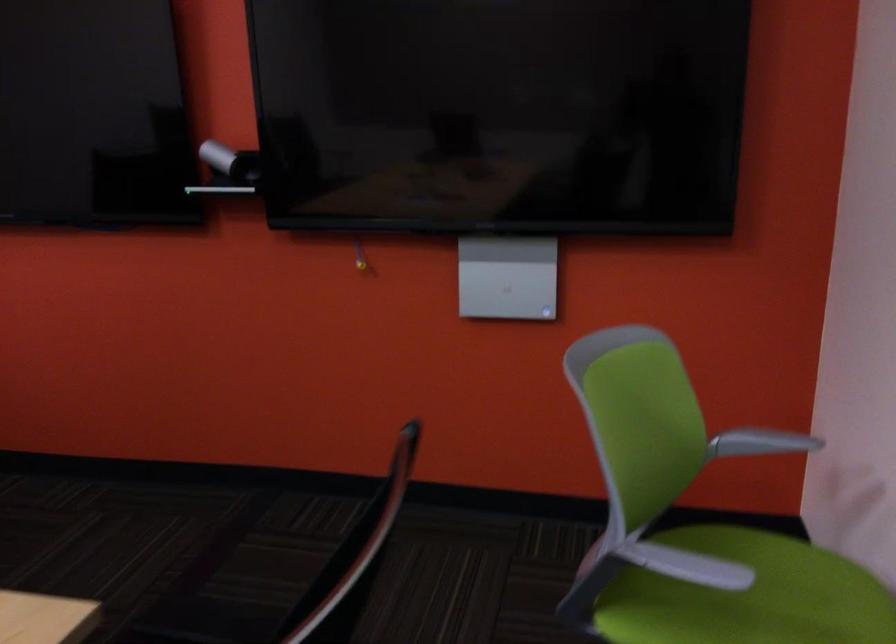
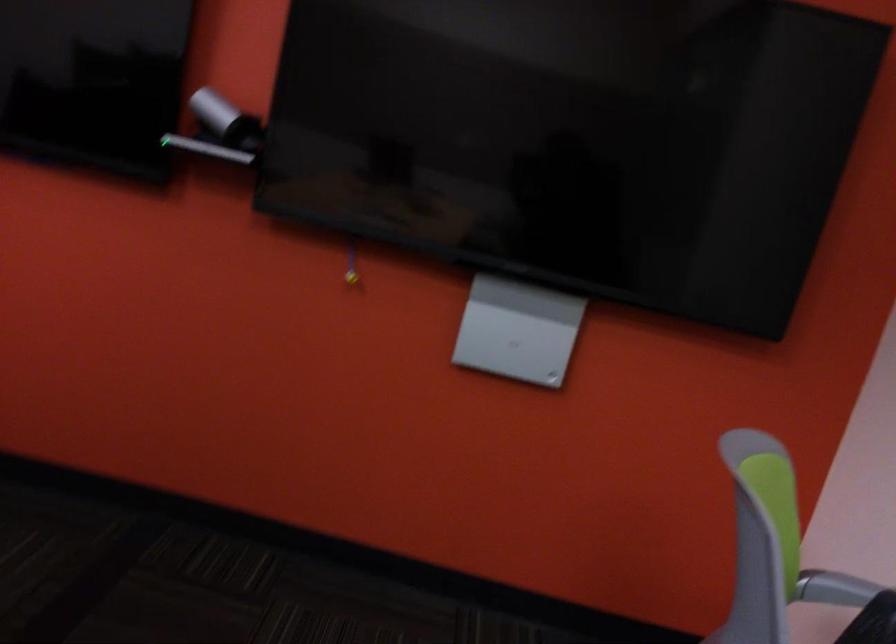
Which direction would the cameraman need to move to produce the second image?

The movement direction of the cameraman is left, forward.